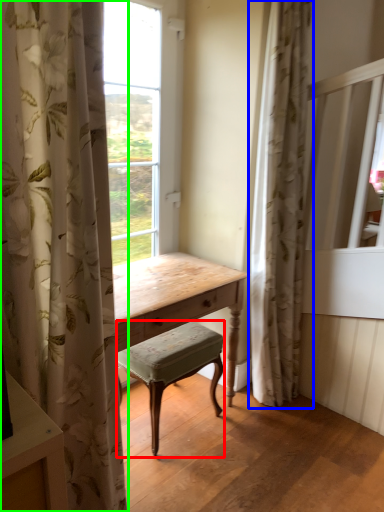
Question: Which is nearer to the stool (highlighted by a red box)? curtain (highlighted by a blue box) or curtain (highlighted by a green box).

Choices:
 (A) curtain
 (B) curtain

Answer: (A)